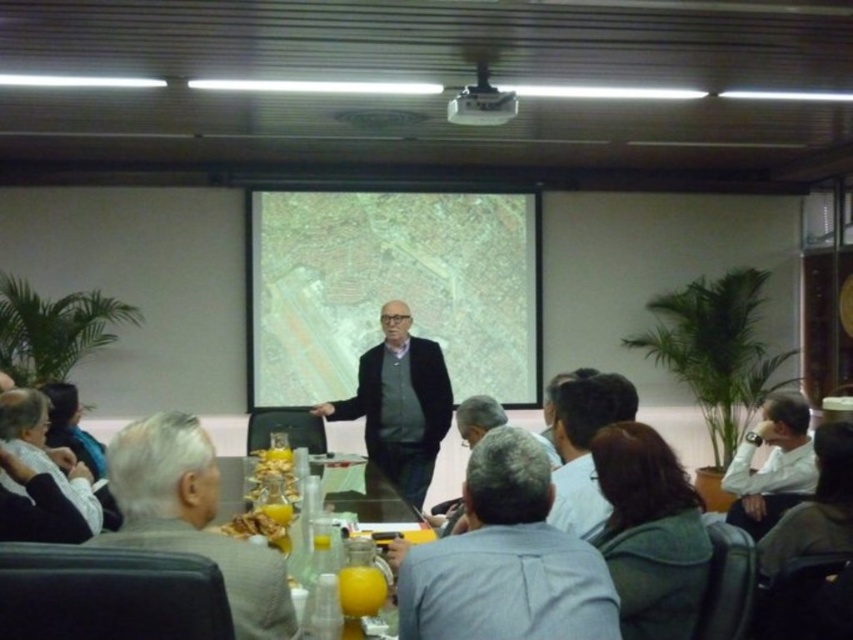
You are sitting at the conference table and need to pass a document to the person wearing the gray fabric shirt at center. The white fabric at lower left is in your way. Can you easily reach around it to hand the document directly?

The white fabric at lower left is further to the viewer than the gray fabric shirt at center, meaning it is closer to you. This obstruction may make it difficult to reach the person wearing the gray fabric shirt at center directly without moving the white fabric at lower left out of the way.

You are sitting at the conference table and want to place a small object on the table. There is a point marked at coordinates (x=39, y=477) on the table. What is located at that point?

The point at coordinates (x=39, y=477) on the table indicates a white fabric at lower left.

From the picture: You are an attendee at the conference table. You notice the gray fabric jacket at lower left and the white plastic projector at upper center. Which object is closer to the floor?

The gray fabric jacket at lower left is closer to the floor since it is located below the white plastic projector at upper center.